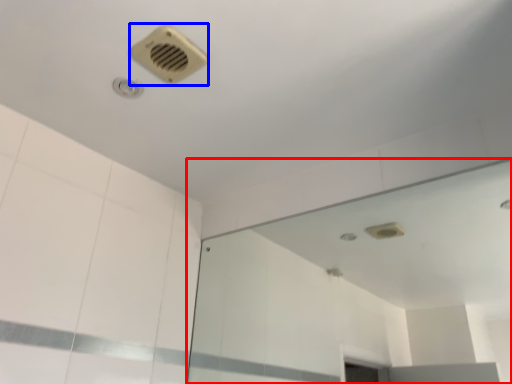
Question: Among these objects, which one is nearest to the camera, mirror (highlighted by a red box) or air conditioning (highlighted by a blue box)?

Choices:
 (A) mirror
 (B) air conditioning

Answer: (A)